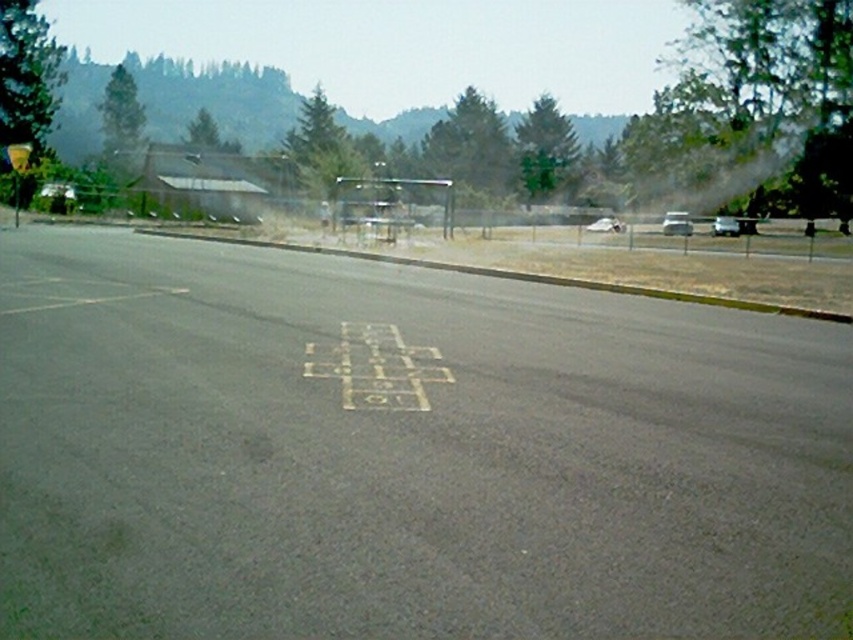
Question: Is yellow plastic sign at upper left below metallic silver car at left?

Choices:
 (A) no
 (B) yes

Answer: (A)

Question: Among these points, which one is nearest to the camera?

Choices:
 (A) (722, 232)
 (B) (65, 182)

Answer: (B)

Question: Among these points, which one is nearest to the camera?

Choices:
 (A) (738, 227)
 (B) (469, 362)
 (C) (683, 220)

Answer: (B)

Question: Can you confirm if silver metallic car at center is bigger than metallic silver car at left?

Choices:
 (A) yes
 (B) no

Answer: (A)

Question: Which of the following is the farthest from the observer?

Choices:
 (A) yellow asphalt hopscotch at center
 (B) white matte car at center

Answer: (B)

Question: Is yellow asphalt hopscotch at center to the right of white glossy car at right from the viewer's perspective?

Choices:
 (A) yes
 (B) no

Answer: (B)